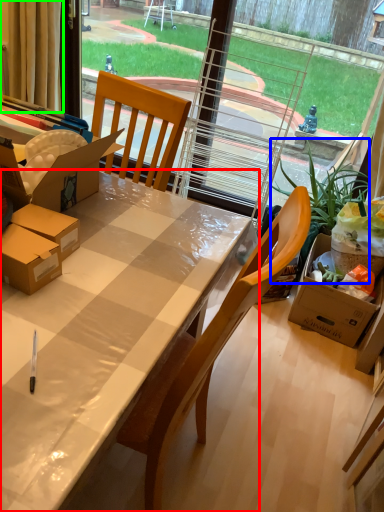
Question: Which object is the farthest from desk (highlighted by a red box)? Choose among these: houseplant (highlighted by a blue box) or curtain (highlighted by a green box).

Choices:
 (A) houseplant
 (B) curtain

Answer: (B)